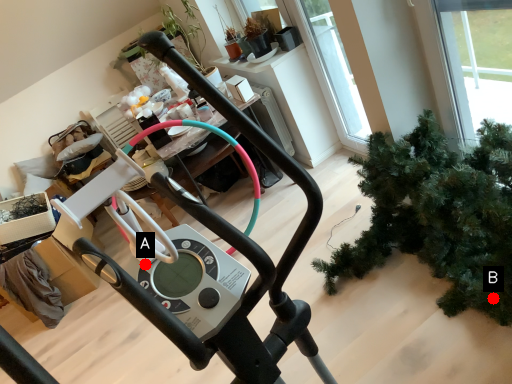
Question: Two points are circled on the image, labeled by A and B beside each circle. Which point is further to the camera?

Choices:
 (A) A is further
 (B) B is further

Answer: (B)